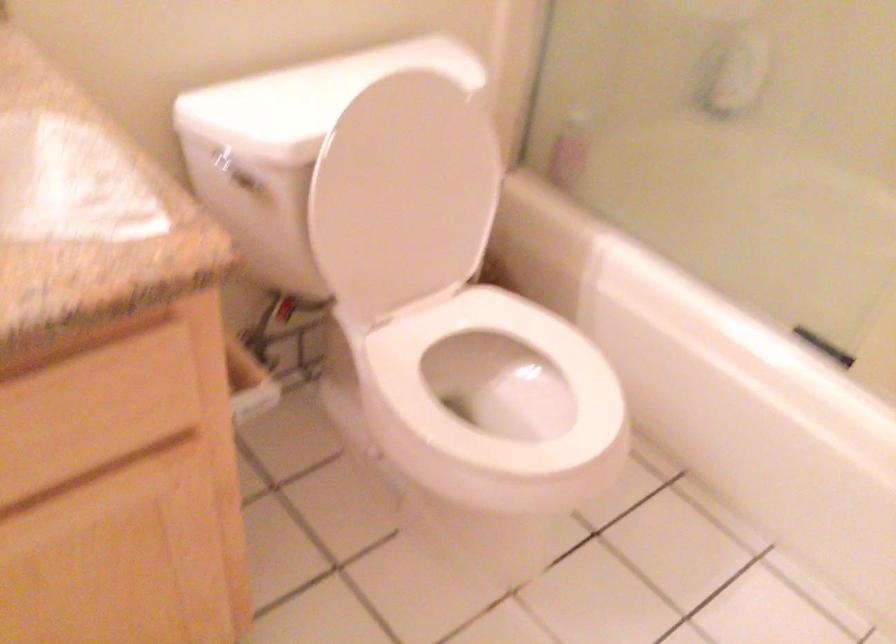
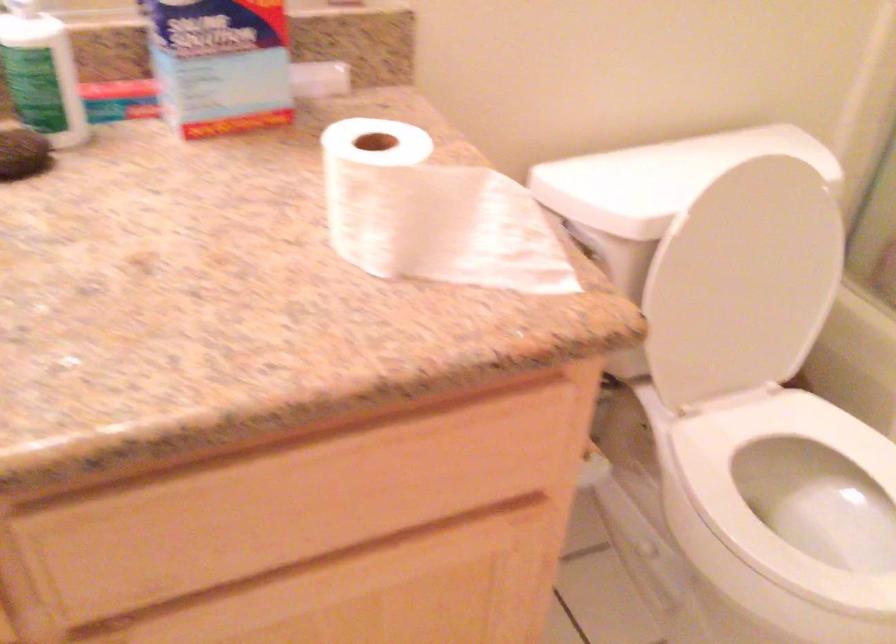
Question: The camera is either moving clockwise (left) or counter-clockwise (right) around the object. The first image is from the beginning of the video and the second image is from the end. Is the camera moving left or right when shooting the video?

Choices:
 (A) Left
 (B) Right

Answer: (B)